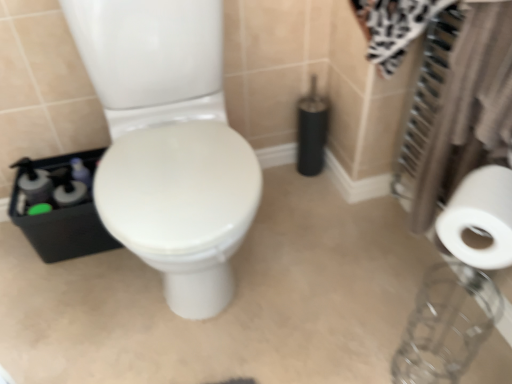
Image resolution: width=512 pixels, height=384 pixels. What do you see at coordinates (169, 143) in the screenshot?
I see `white glossy toilet at center` at bounding box center [169, 143].

Identify the location of white glossy toilet at center. (169, 143).

Locate an element on the screen. The image size is (512, 384). white glossy toilet at center is located at coordinates (169, 143).